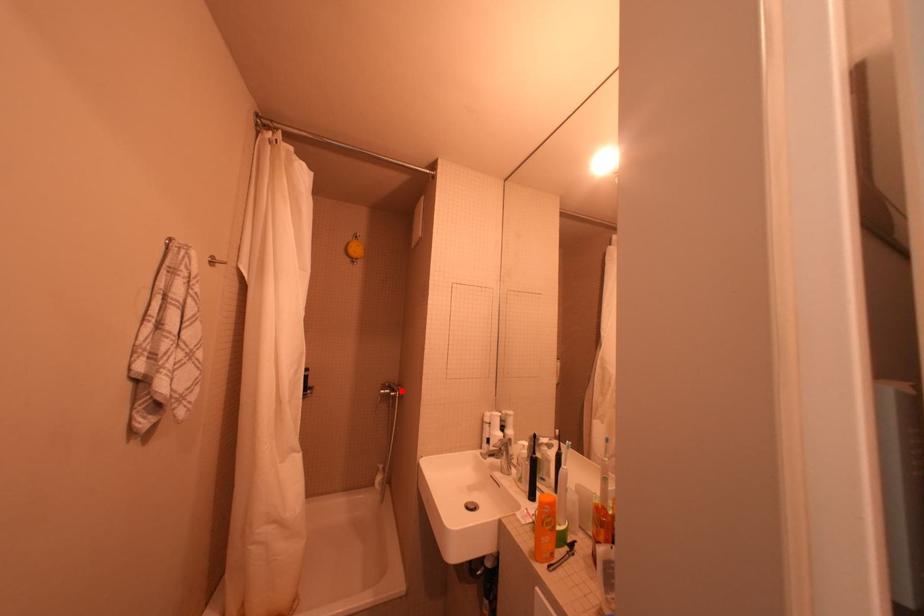
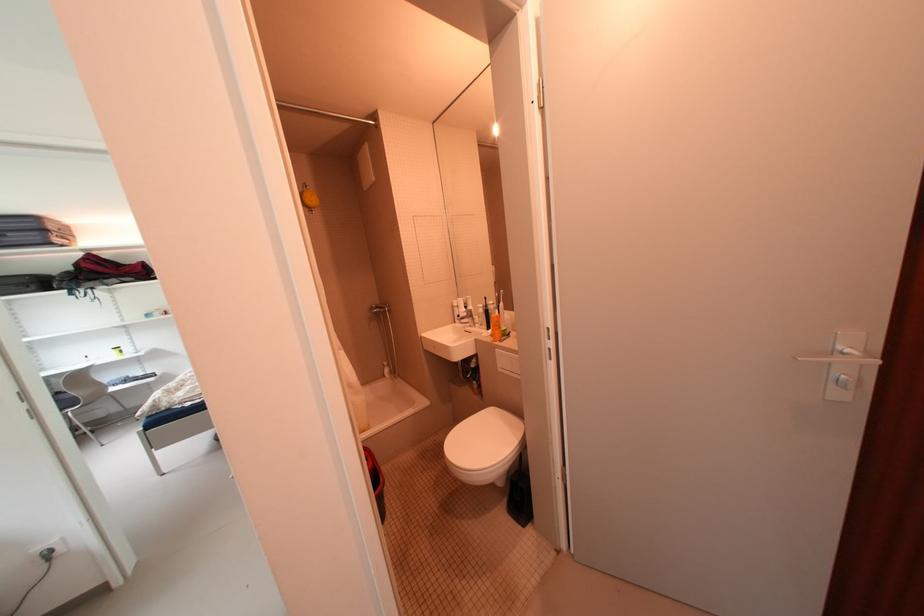
In the second image, find the point that corresponds to the highlighted location in the first image.

(390, 309)